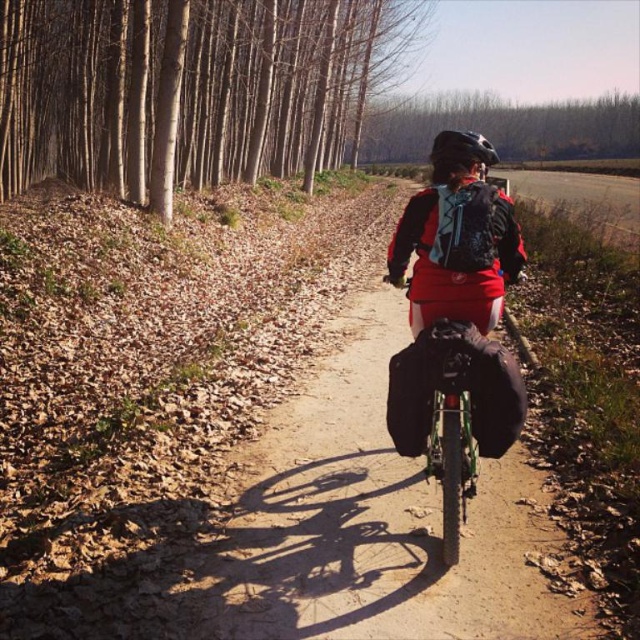
Question: Does matte black jacket at center have a smaller size compared to matte black helmet at center?

Choices:
 (A) yes
 (B) no

Answer: (A)

Question: Which of the following is the farthest from the observer?

Choices:
 (A) (465, 147)
 (B) (525, 262)

Answer: (B)

Question: Which point is farther to the camera?

Choices:
 (A) (490, 236)
 (B) (461, 152)

Answer: (B)

Question: Which point is farther to the camera?

Choices:
 (A) matte black jacket at center
 (B) matte black helmet at center

Answer: (B)

Question: Can you confirm if matte black jacket at center is bigger than matte black helmet at center?

Choices:
 (A) yes
 (B) no

Answer: (B)

Question: Does matte black jacket at center appear over matte black helmet at center?

Choices:
 (A) no
 (B) yes

Answer: (A)